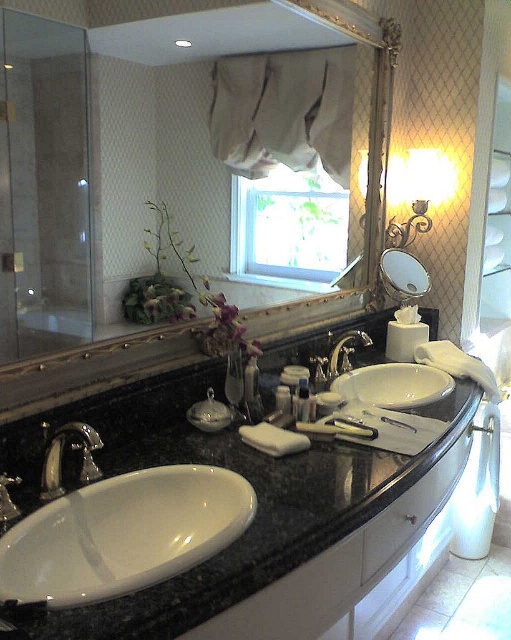
Question: Is gold-framed mirror at upper center bigger than white glossy sink at center?

Choices:
 (A) yes
 (B) no

Answer: (A)

Question: Can you confirm if gold-framed mirror at upper center is wider than matte glass jar at center?

Choices:
 (A) no
 (B) yes

Answer: (B)

Question: Considering the real-world distances, which object is closest to the matte plastic container at center?

Choices:
 (A) matte glass mirror at upper center
 (B) translucent plastic tube at center
 (C) polished chrome faucet at lower left
 (D) white glossy sink at center

Answer: (B)

Question: Among these objects, which one is nearest to the camera?

Choices:
 (A) white glossy sink at center
 (B) white glossy sink at lower left
 (C) matte glass jar at center
 (D) black granite countertop at center

Answer: (D)

Question: Which object is the farthest from the silver metallic faucet at center?

Choices:
 (A) matte glass mirror at upper center
 (B) translucent plastic tube at center
 (C) matte plastic container at center
 (D) white glossy sink at center

Answer: (B)

Question: Is black granite countertop at center to the right of white glossy sink at center from the viewer's perspective?

Choices:
 (A) no
 (B) yes

Answer: (A)